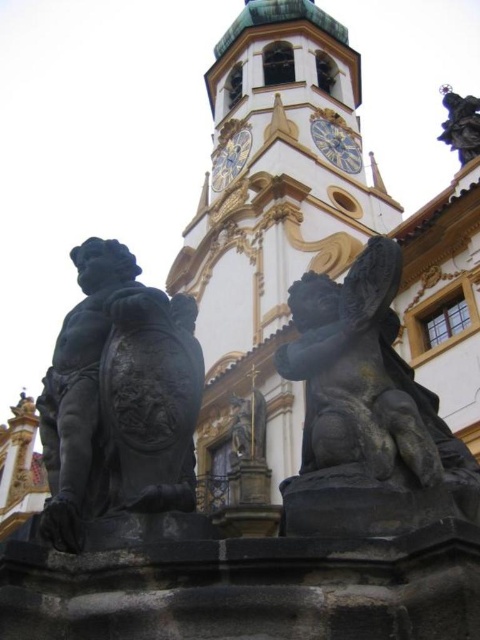
You are standing in front of the historic building and see a point marked at coordinates (119, 397). What object is located at that point?

The point at coordinates (119, 397) corresponds to the black polished statue at left.

You are an architect analyzing the facade of the historic building. You notice a point marked at coordinates point (x=365, y=412). Based on the scene description, what object is located at this point?

The point (x=365, y=412) corresponds to the dark gray stone cherub at right.